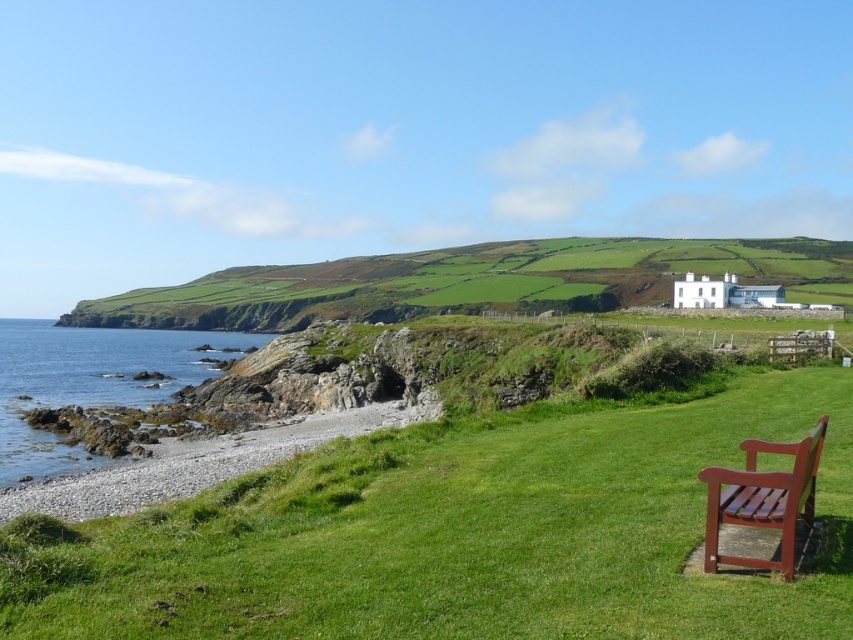
Question: Among these points, which one is farthest from the camera?

Choices:
 (A) (395, 445)
 (B) (782, 538)
 (C) (846, 300)
 (D) (219, 461)

Answer: (C)

Question: Which object is the closest to the mahogany wood bench at lower right?

Choices:
 (A) smooth pebbles at lower left
 (B) green grassy at lower right

Answer: (B)

Question: Which of the following is the farthest from the observer?

Choices:
 (A) green grassy at lower right
 (B) smooth pebbles at lower left
 (C) gray rocky water at lower left

Answer: (C)

Question: Is gray rocky water at lower left bigger than smooth pebbles at lower left?

Choices:
 (A) no
 (B) yes

Answer: (B)

Question: Does green grassy at lower right have a lesser width compared to mahogany wood bench at lower right?

Choices:
 (A) yes
 (B) no

Answer: (B)

Question: Is gray rocky water at lower left positioned at the back of smooth pebbles at lower left?

Choices:
 (A) yes
 (B) no

Answer: (A)